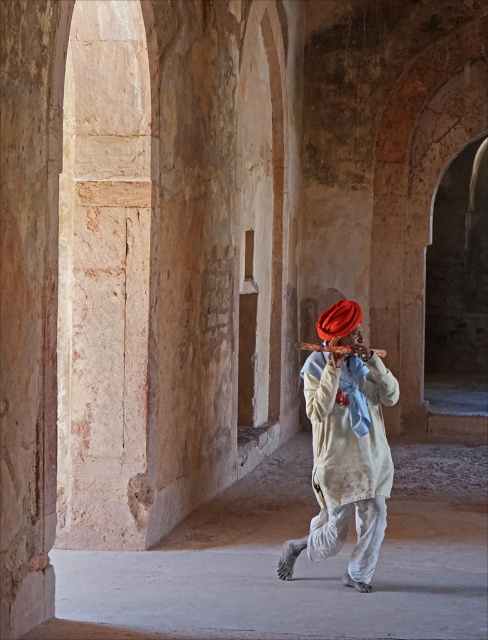
Can you confirm if matte white fabric at center is positioned to the right of shiny orange turban at center?

In fact, matte white fabric at center is to the left of shiny orange turban at center.

Locate an element on the screen. matte white fabric at center is located at coordinates (345, 448).

Between point (329, 524) and point (342, 316), which one is positioned behind?

The point (329, 524) is behind.

Where is `matte white fabric at center`? Image resolution: width=488 pixels, height=640 pixels. matte white fabric at center is located at coordinates (345, 448).